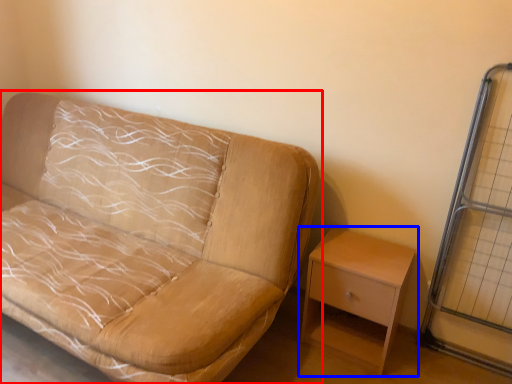
Question: Which object is further to the camera taking this photo, studio couch (highlighted by a red box) or nightstand (highlighted by a blue box)?

Choices:
 (A) studio couch
 (B) nightstand

Answer: (B)